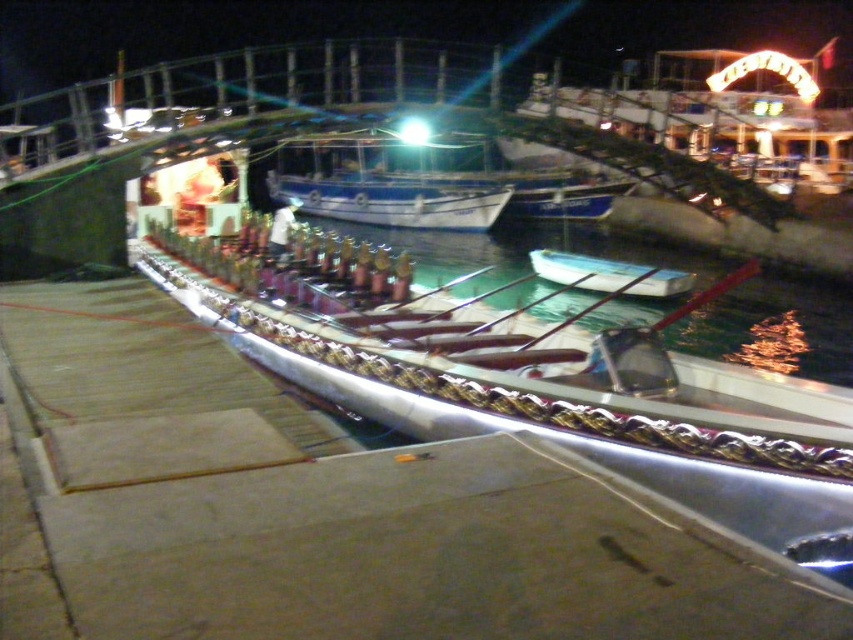
You are standing on the pier and see the blue glossy boat at center and the white glossy boat at center. Which boat is positioned to the left when facing the dock?

The blue glossy boat at center is positioned to the left of the white glossy boat at center when facing the dock.

You are standing on the pier and want to board the white glossy boat at center. Based on the scene, is the clear water at center between you and the boat, or behind the boat?

The clear water at center is much taller than the white glossy boat at center, so the boat is positioned in front of the water from your perspective. Therefore, the clear water at center is behind the white glossy boat at center.

You are standing on the pier and see the clear water at center and the white glossy boat at center. Which object is positioned to the left of the other?

The clear water at center is to the left of white glossy boat at center.